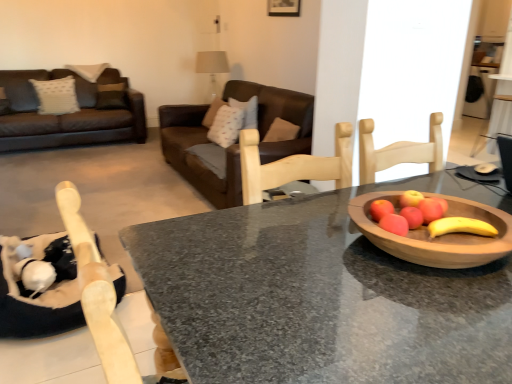
You are a GUI agent. You are given a task and a screenshot of the screen. Output one action in this format:
    pyautogui.click(x=<x>, y=<y>)
    Task: Click on the blank space above granite table at center (from a real-world perspective)
    
    Given the screenshot: What is the action you would take?
    pyautogui.click(x=362, y=254)